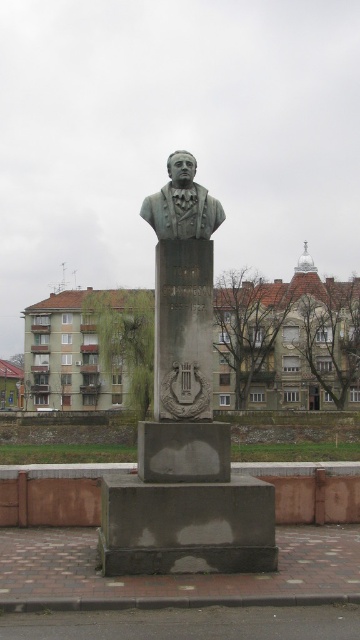
Which is above, green polished bust at center or green patina bust at center?

Positioned higher is green patina bust at center.

How far apart are green polished bust at center and green patina bust at center?

They are 6.92 feet apart.

Does point (226, 465) lie behind point (168, 234)?

No, (226, 465) is closer to viewer.

What are the coordinates of `green polished bust at center` in the screenshot? It's located at tap(185, 419).